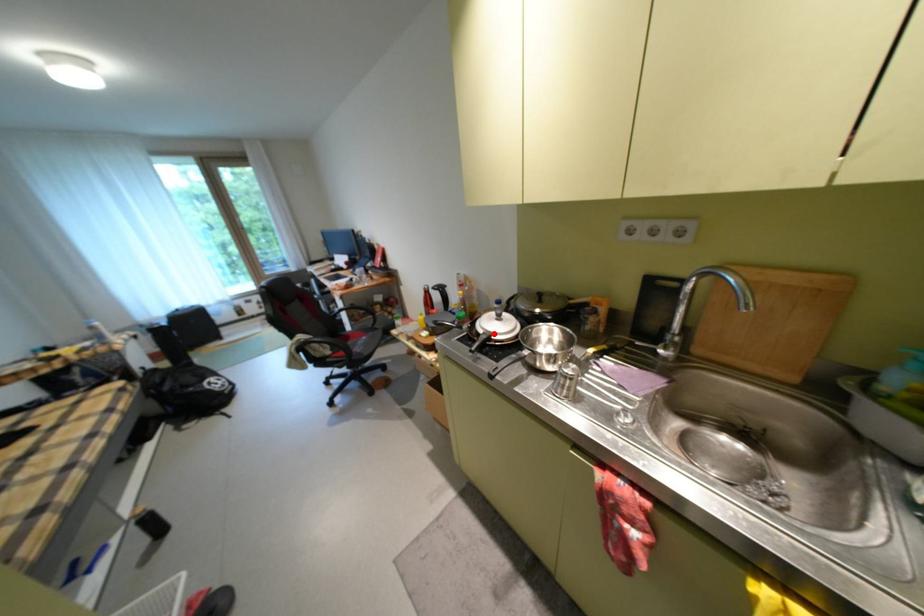
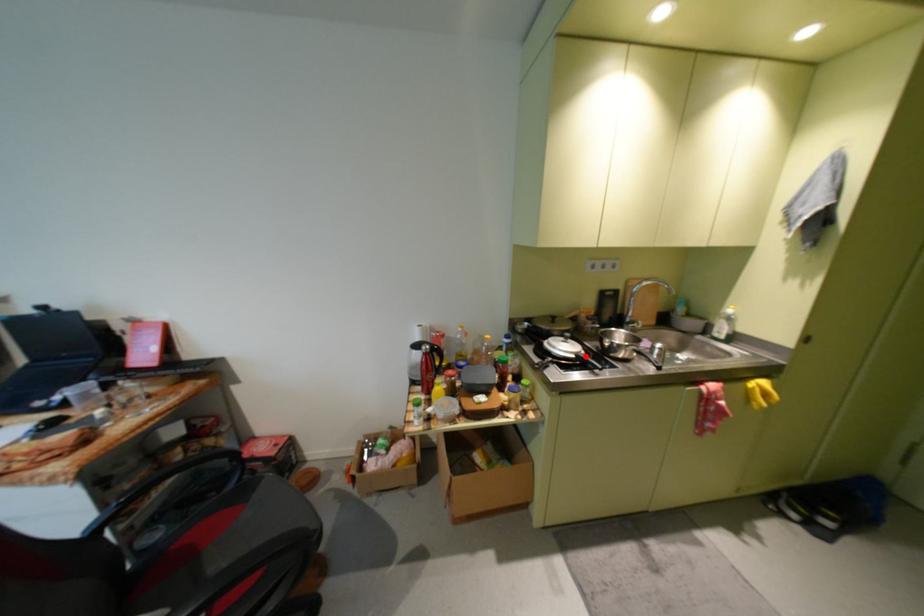
I am providing you with two images of the same scene from different viewpoints. A red point is marked on the first image and another point is marked on the second image. Is the marked point in image1 the same physical position as the marked point in image2?

Yes